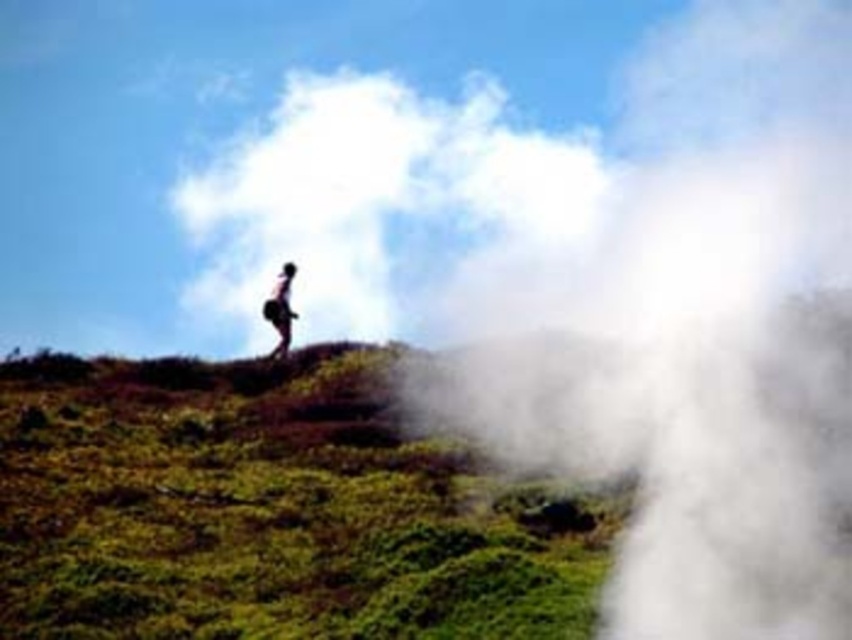
You are standing at the viewpoint and want to reach the point marked as point (370, 348). If your walking speed is 1.2 meters per second, how many seconds will it take to reach that point?

The point (370, 348) is 56.84 meters away from the viewer. At a walking speed of 1.2 meters per second, it would take approximately 56.84 divided by 1.2, which is about 47.37 seconds. So, it will take roughly 47 seconds to reach the point.

In the scene shown: You are a photographer planning to capture the light brown skin at center and the white fluffy cloud at upper center in the same frame. Which object will occupy more space in your photo?

The white fluffy cloud at upper center will occupy more space in the photo because its width is larger than the light brown skin at center.

You are standing on the hilltop and want to take a photo of the white foggy steam at upper right and the green grassy at center. Which object will appear larger in your photo?

The white foggy steam at upper right will appear larger in your photo because it is taller than the green grassy at center.